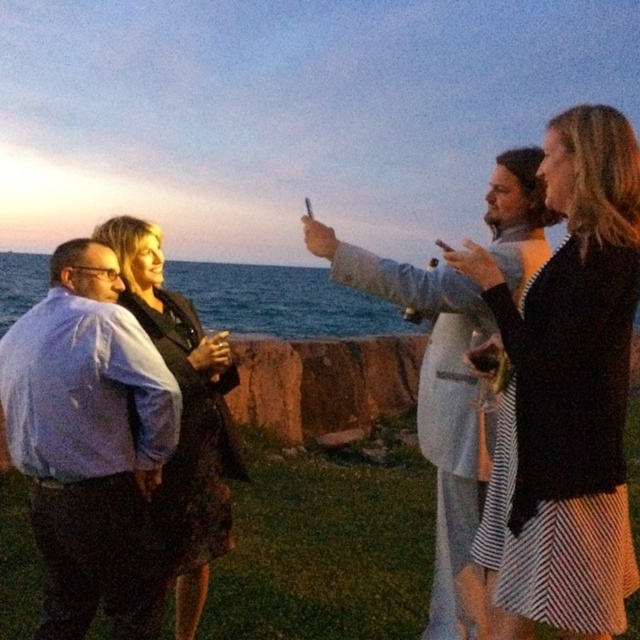
Is matte gray phone at upper center taller than black lace dress at center?

Correct, matte gray phone at upper center is much taller as black lace dress at center.

Which of these two, matte gray phone at upper center or black lace dress at center, stands taller?

With more height is matte gray phone at upper center.

This screenshot has height=640, width=640. What do you see at coordinates (435, 400) in the screenshot?
I see `matte gray phone at upper center` at bounding box center [435, 400].

Locate an element on the screen. This screenshot has width=640, height=640. matte gray phone at upper center is located at coordinates (435, 400).

Does light blue shirt at left come behind black lace dress at center?

No, it is in front of black lace dress at center.

Between point (104, 355) and point (209, 465), which one is positioned in front?

Point (104, 355) is in front.

Where is `light blue shirt at left`? light blue shirt at left is located at coordinates (90, 444).

This screenshot has width=640, height=640. Describe the element at coordinates (564, 396) in the screenshot. I see `black textured dress at center` at that location.

Does point (556, 602) lie in front of point (36, 424)?

Yes, point (556, 602) is in front of point (36, 424).

At what (x,y) coordinates should I click in order to perform the action: click on black textured dress at center. Please return your answer as a coordinate pair (x, y). This screenshot has height=640, width=640. Looking at the image, I should click on (564, 396).

Locate an element on the screen. The height and width of the screenshot is (640, 640). black textured dress at center is located at coordinates (564, 396).